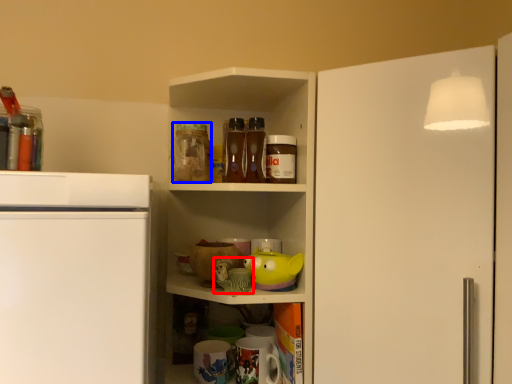
Question: Which object is further to the camera taking this photo, toy (highlighted by a red box) or beverage (highlighted by a blue box)?

Choices:
 (A) toy
 (B) beverage

Answer: (B)